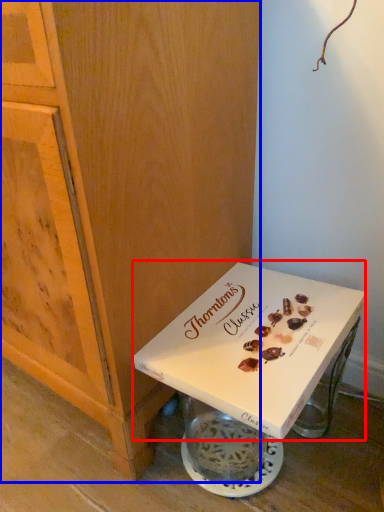
Question: Which object appears closest to the camera in this image, box (highlighted by a red box) or cabinetry (highlighted by a blue box)?

Choices:
 (A) box
 (B) cabinetry

Answer: (B)